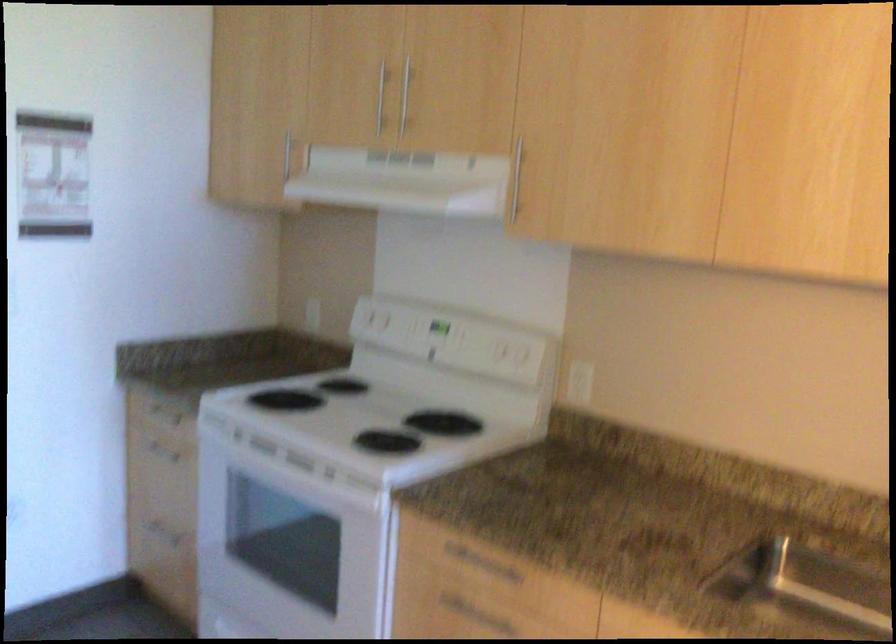
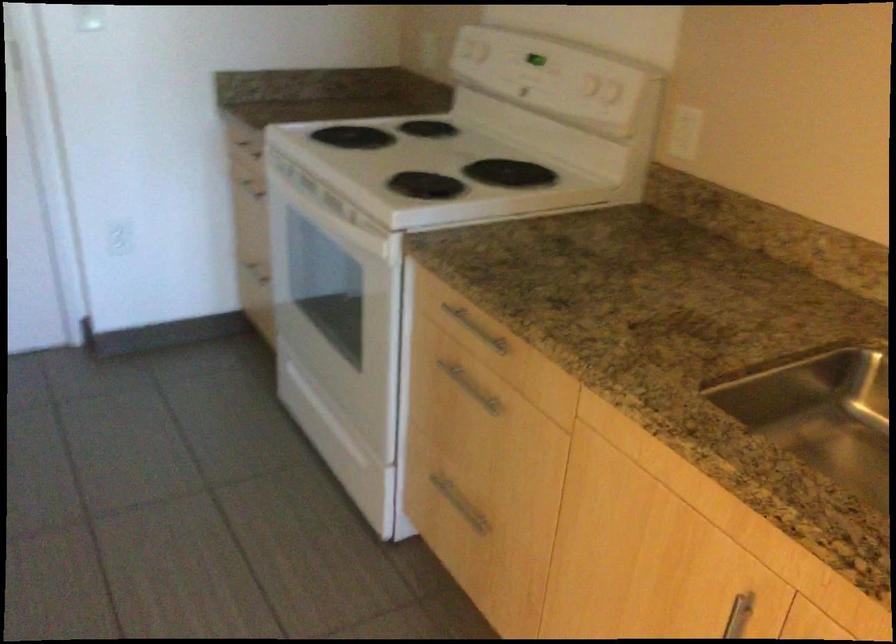
The images are taken continuously from a first-person perspective. In which direction are you moving?

The cameraman walked toward right, forward.